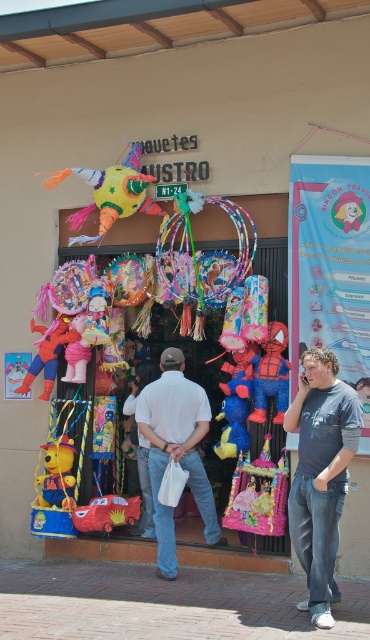
You are standing at the entrance of the shop Pi?ntas y Mu?ecas. You want to take a photo of the point marked at coordinate (324, 426). If your camera has a focal length of 50mm and you are 6.36 meters away from the point, what is the required distance in millimeters between the camera lens and the image sensor to capture the point sharply?

The required distance between the camera lens and the image sensor to capture the point sharply is calculated using the lens formula 1?f?1?u?1?v, where f is the focal length, u is the object distance, and v is the image distance. Plugging in the values, 1?50mm?1?6360mm?1?v. Solving for v gives approximately 50.45mm. Therefore, the distance should be set to approximately 50.45 millimeters.

You are a customer looking at the storefront of Pi?atas y Mu?ecas. You see a denim jeans at lower right and a white matte shirt at center. Which one is positioned to the right side?

The denim jeans at lower right is positioned to the right of the white matte shirt at center, so the denim jeans at lower right is the one on the right side.

You are standing in front of the shop and want to take a photo. You notice two points marked in the image. Which point, point 1 at coordinates (153, 490) or point 2 at coordinates (54, 364), is closer to you when you take the photo?

Point 1 at coordinates (153, 490) is closer to you than point 2 at coordinates (54, 364).